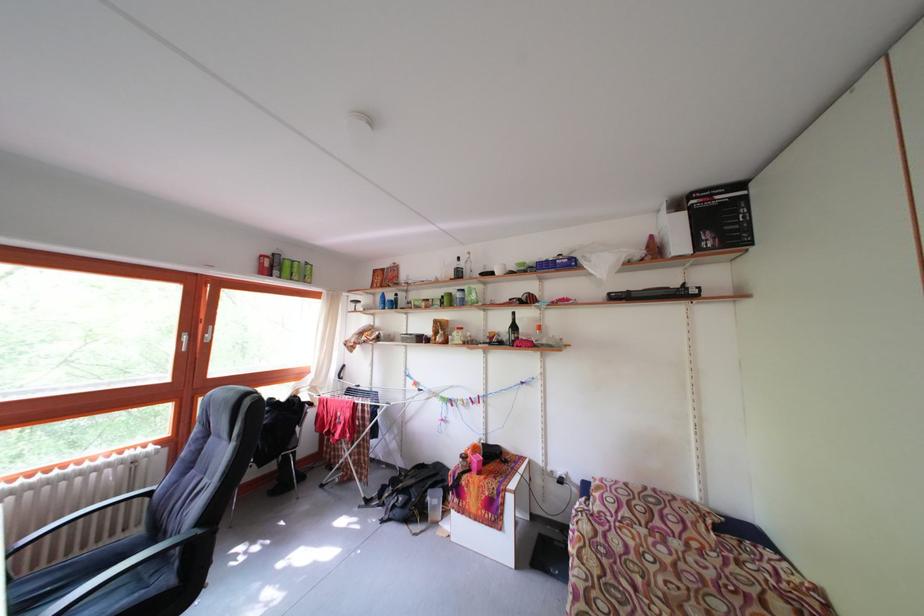
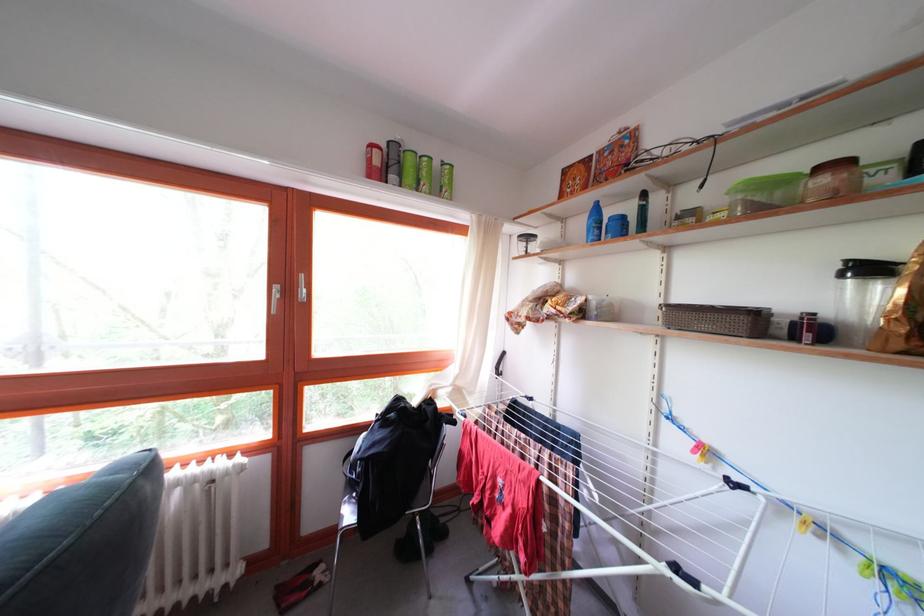
Find the pixel in the second image that matches (388,297) in the first image.

(598, 204)